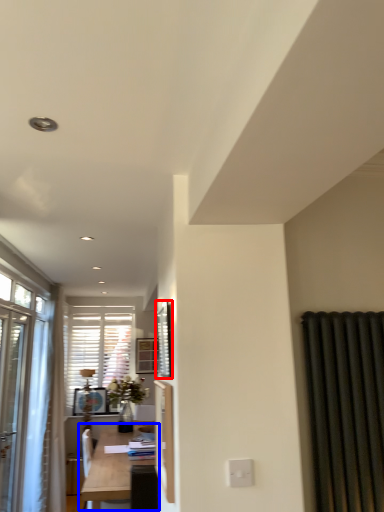
Question: Which object is closer to the camera taking this photo, window screen (highlighted by a red box) or table (highlighted by a blue box)?

Choices:
 (A) window screen
 (B) table

Answer: (A)